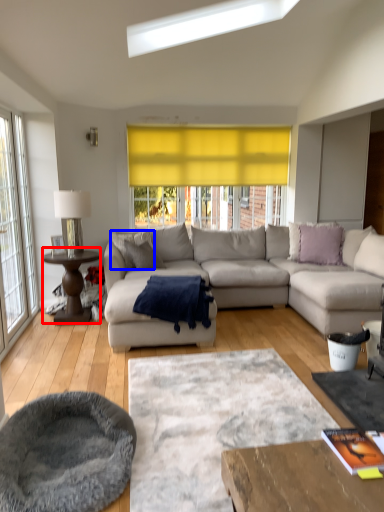
Question: Which object is closer to the camera taking this photo, coffee table (highlighted by a red box) or pillow (highlighted by a blue box)?

Choices:
 (A) coffee table
 (B) pillow

Answer: (A)